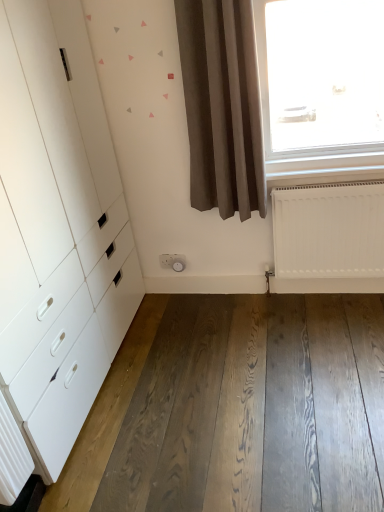
Question: Considering the relative sizes of white matte radiator at lower right and brown matte curtain at center in the image provided, is white matte radiator at lower right thinner than brown matte curtain at center?

Choices:
 (A) no
 (B) yes

Answer: (B)

Question: Does white matte radiator at lower right appear on the right side of brown matte curtain at center?

Choices:
 (A) yes
 (B) no

Answer: (A)

Question: Is white matte radiator at lower right positioned with its back to brown matte curtain at center?

Choices:
 (A) no
 (B) yes

Answer: (A)

Question: Is white matte radiator at lower right shorter than brown matte curtain at center?

Choices:
 (A) yes
 (B) no

Answer: (A)

Question: Does white matte radiator at lower right come in front of brown matte curtain at center?

Choices:
 (A) no
 (B) yes

Answer: (A)

Question: Is white matte radiator at lower right wider or thinner than dark brown wood flooring at lower center?

Choices:
 (A) thin
 (B) wide

Answer: (A)

Question: Choose the correct answer: Is white matte radiator at lower right inside dark brown wood flooring at lower center or outside it?

Choices:
 (A) inside
 (B) outside

Answer: (B)

Question: Looking at the image, does white matte radiator at lower right seem bigger or smaller compared to dark brown wood flooring at lower center?

Choices:
 (A) big
 (B) small

Answer: (B)

Question: In the image, is white matte radiator at lower right on the left side or the right side of dark brown wood flooring at lower center?

Choices:
 (A) left
 (B) right

Answer: (B)

Question: In terms of width, does dark brown wood flooring at lower center look wider or thinner when compared to white plastic socket at center?

Choices:
 (A) thin
 (B) wide

Answer: (B)

Question: From a real-world perspective, is dark brown wood flooring at lower center positioned above or below white plastic socket at center?

Choices:
 (A) above
 (B) below

Answer: (B)

Question: Would you say dark brown wood flooring at lower center is inside or outside white plastic socket at center?

Choices:
 (A) outside
 (B) inside

Answer: (A)

Question: From the image's perspective, is dark brown wood flooring at lower center above or below white plastic socket at center?

Choices:
 (A) above
 (B) below

Answer: (B)

Question: From a real-world perspective, is white plastic socket at center physically located above or below white matte chest of drawers at left?

Choices:
 (A) below
 (B) above

Answer: (A)

Question: Is point (178, 266) closer or farther from the camera than point (64, 139)?

Choices:
 (A) closer
 (B) farther

Answer: (B)